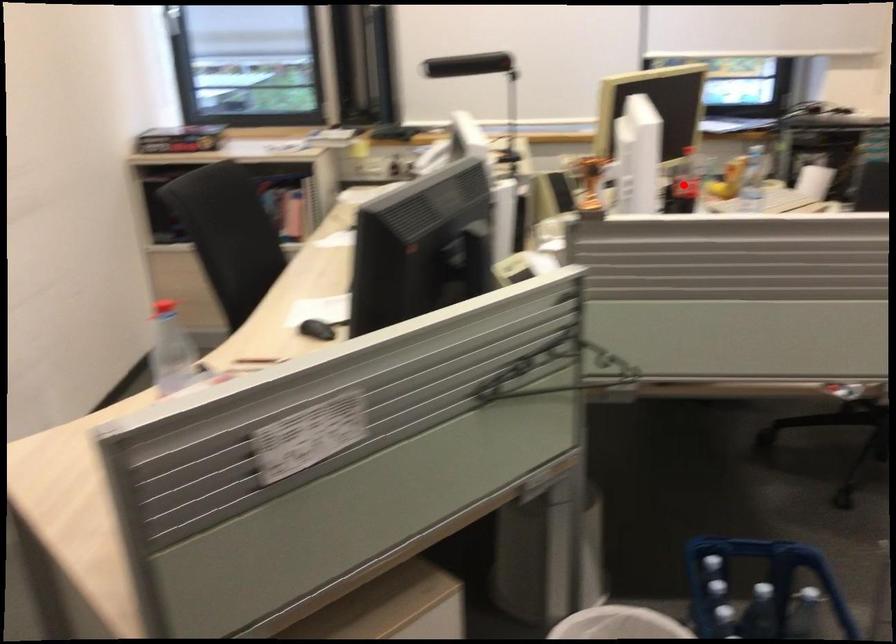
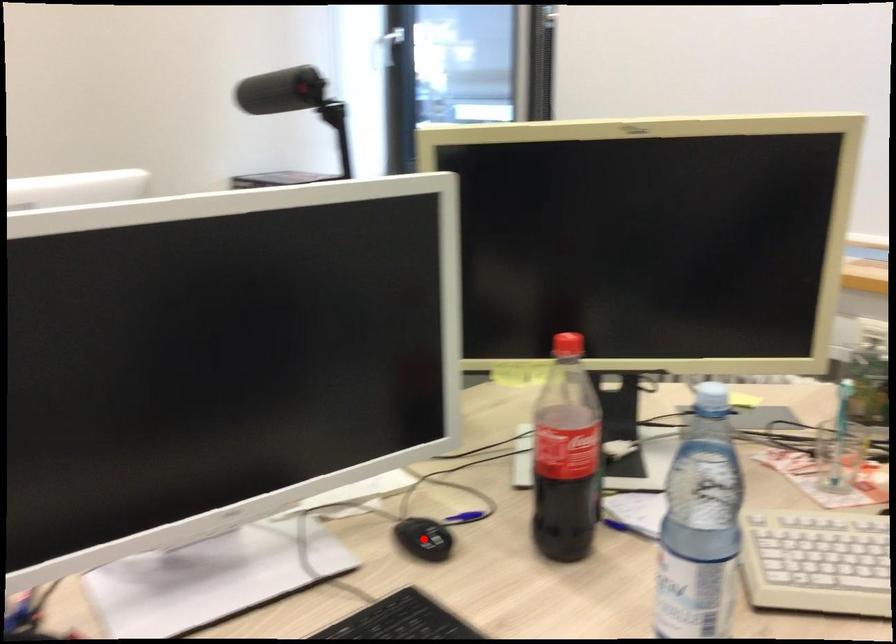
I am providing you with two images of the same scene from different viewpoints. A red point is marked on the first image and another point is marked on the second image. Are the points marked in image1 and image2 representing the same 3D position?

No